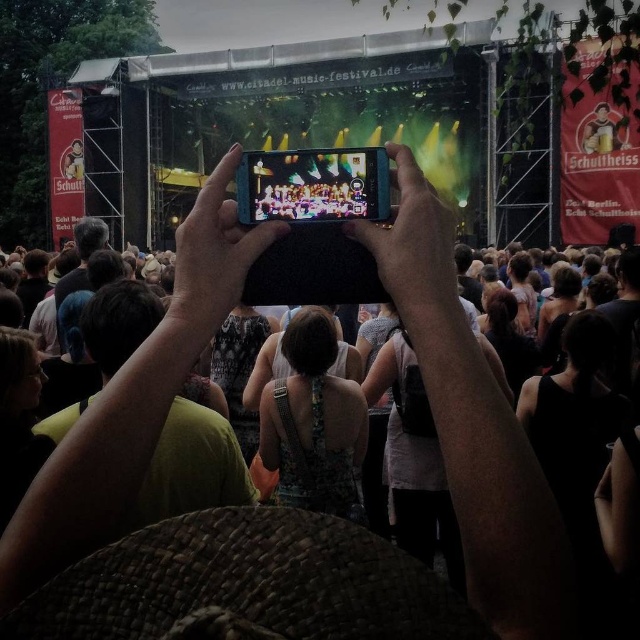
Question: Which object is positioned farthest from the black matte phone at center?

Choices:
 (A) dark fabric crowd at center
 (B) smooth black phone at center

Answer: (B)

Question: Observing the image, what is the correct spatial positioning of black matte phone at center in reference to smooth black phone at center?

Choices:
 (A) left
 (B) right

Answer: (B)

Question: Does dark fabric crowd at center come behind black matte phone at center?

Choices:
 (A) yes
 (B) no

Answer: (B)

Question: Which object is positioned farthest from the dark fabric crowd at center?

Choices:
 (A) smooth black phone at center
 (B) black matte phone at center

Answer: (A)

Question: Can you confirm if dark fabric crowd at center is bigger than smooth black phone at center?

Choices:
 (A) no
 (B) yes

Answer: (B)

Question: Which object is closer to the camera taking this photo?

Choices:
 (A) black matte phone at center
 (B) smooth black phone at center
 (C) dark fabric crowd at center

Answer: (C)